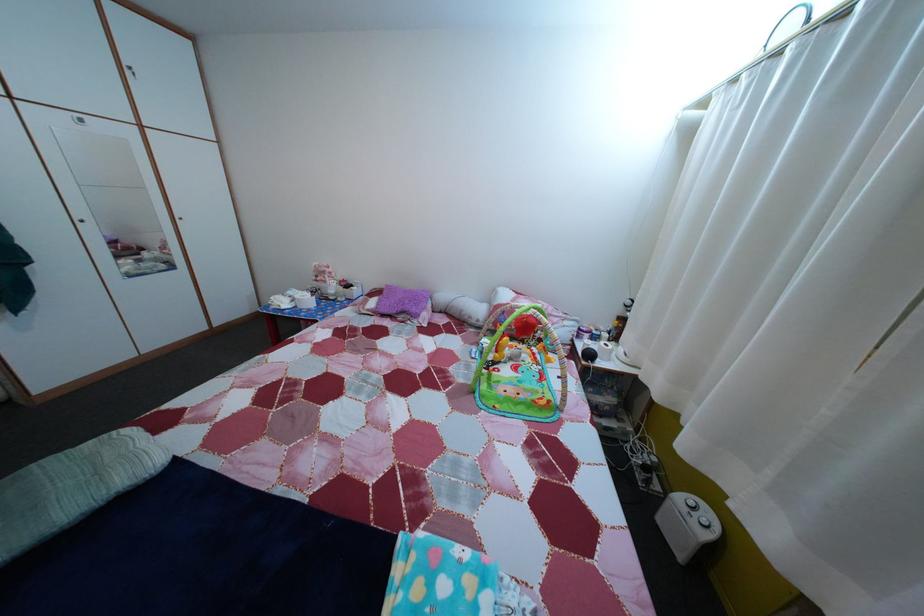
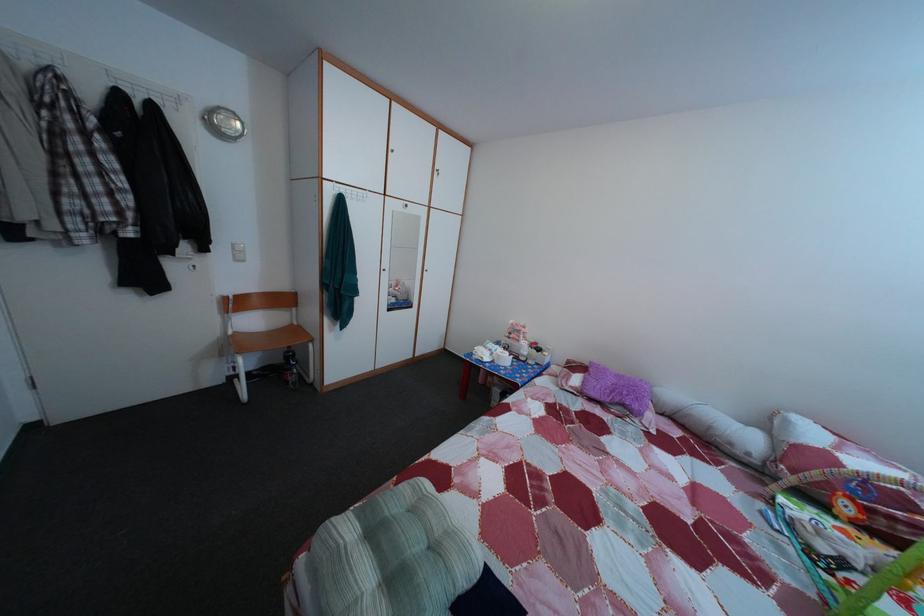
Find the pixel in the second image that matches (x=334, y=290) in the first image.

(528, 349)